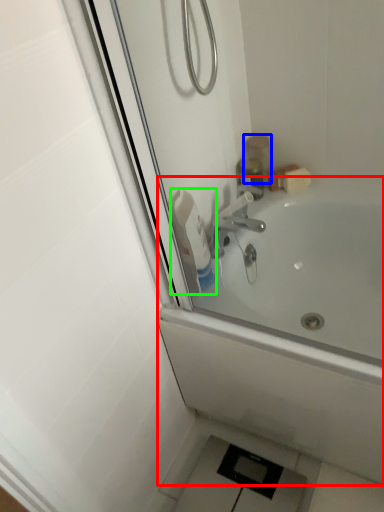
Question: Estimate the real-world distances between objects in this image. Which object is farther from bathtub (highlighted by a red box), toiletry (highlighted by a blue box) or cleaning product (highlighted by a green box)?

Choices:
 (A) toiletry
 (B) cleaning product

Answer: (A)